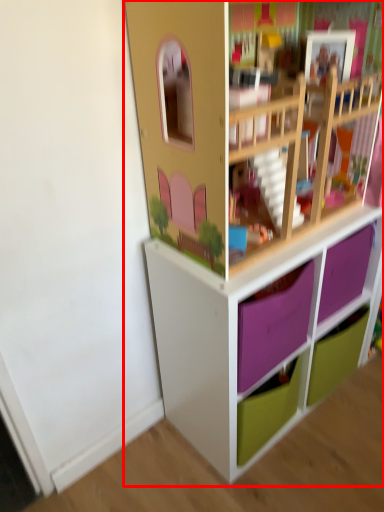
Question: Considering the relative positions of shelf (annotated by the red box) and drawer in the image provided, where is shelf (annotated by the red box) located with respect to the staircase?

Choices:
 (A) left
 (B) right

Answer: (A)